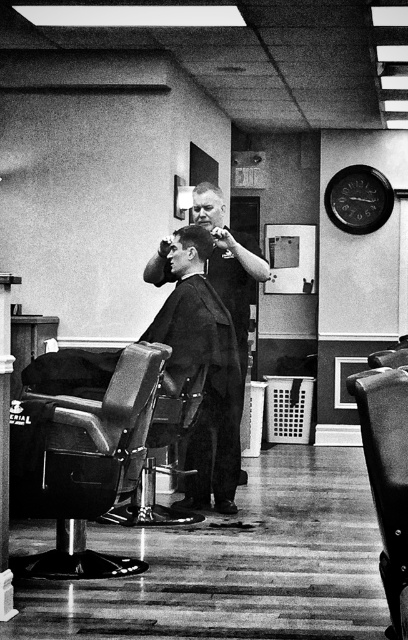
Can you confirm if smooth black barber at center is taller than metallic leather chair at right?

Yes.

Is smooth black barber at center wider than metallic leather chair at right?

Indeed, smooth black barber at center has a greater width compared to metallic leather chair at right.

What do you see at coordinates (239, 358) in the screenshot? I see `smooth black barber at center` at bounding box center [239, 358].

Find the location of `smooth black barber at center`. smooth black barber at center is located at coordinates (239, 358).

Which is more to the right, smooth black barber at center or short dark hair at center?

Positioned to the right is smooth black barber at center.

Which is more to the left, smooth black barber at center or short dark hair at center?

short dark hair at center is more to the left.

The width and height of the screenshot is (408, 640). Describe the element at coordinates (239, 358) in the screenshot. I see `smooth black barber at center` at that location.

Where is `smooth black barber at center`? This screenshot has height=640, width=408. smooth black barber at center is located at coordinates (239, 358).

Is the position of smooth black barber chair at center more distant than that of metallic leather chair at right?

Yes.

Between point (119, 356) and point (390, 436), which one is positioned behind?

Positioned behind is point (119, 356).

Where is `smooth black barber chair at center`? The width and height of the screenshot is (408, 640). smooth black barber chair at center is located at coordinates (197, 332).